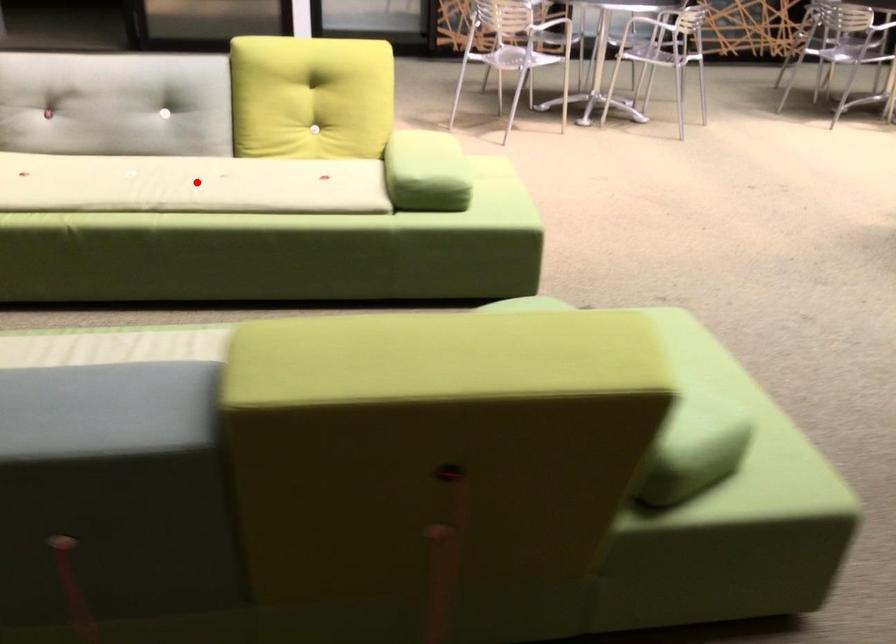
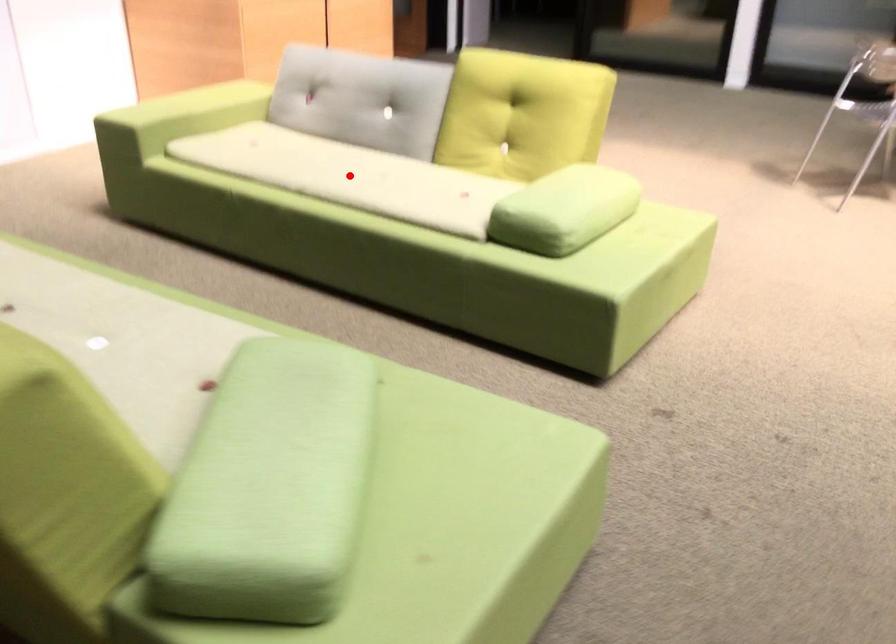
I am providing you with two images of the same scene from different viewpoints. A red point is marked on the first image and another point is marked on the second image. Is the red point in image1 aligned with the point shown in image2?

Yes